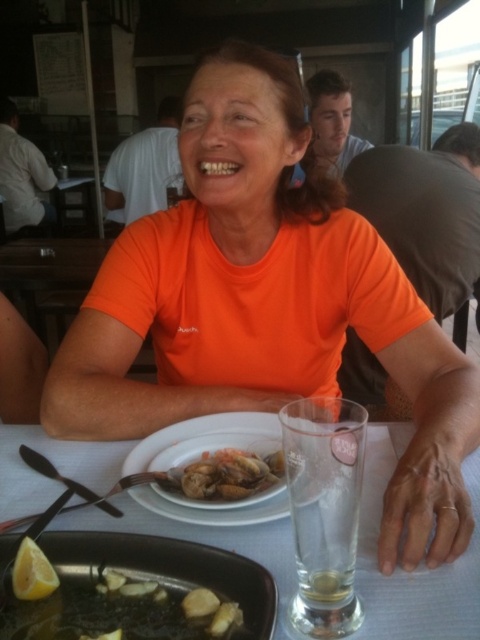
Question: Among these objects, which one is farthest from the camera?

Choices:
 (A) white glossy plate at center
 (B) shiny brown clams at center
 (C) shiny silver pan at lower left
 (D) white matte plate at center

Answer: (B)

Question: In this image, where is white glossy plate at center located relative to shiny brown clams at center?

Choices:
 (A) below
 (B) above

Answer: (A)

Question: Which point appears farthest from the camera in this image?

Choices:
 (A) (79, 460)
 (B) (242, 481)
 (C) (279, 440)

Answer: (A)

Question: Which point appears farthest from the camera in this image?

Choices:
 (A) (456, 593)
 (B) (278, 477)
 (C) (216, 502)
 (D) (112, 572)

Answer: (B)

Question: Observing the image, what is the correct spatial positioning of shiny silver pan at lower left in reference to shiny brown clams at center?

Choices:
 (A) below
 (B) above

Answer: (A)

Question: Does shiny silver pan at lower left have a larger size compared to white matte plate at center?

Choices:
 (A) no
 (B) yes

Answer: (A)